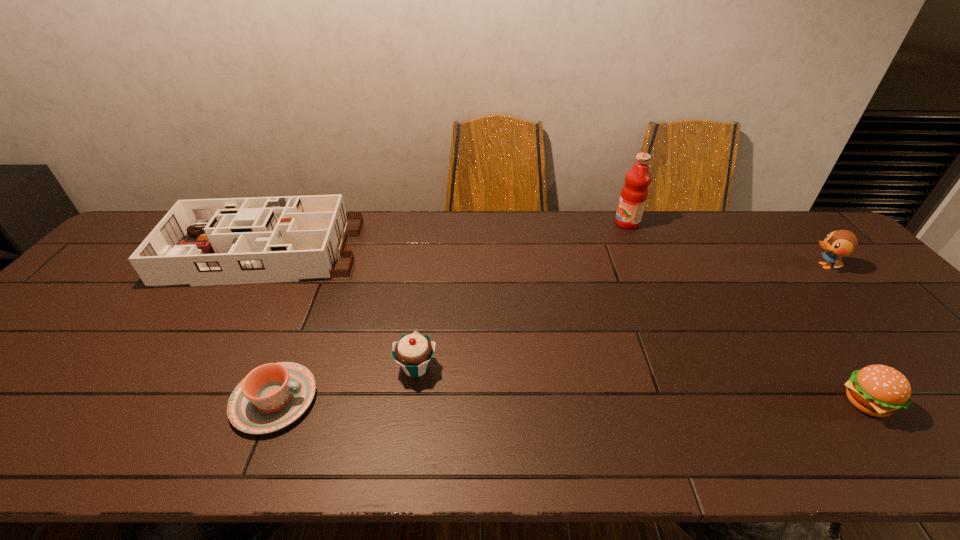
Identify the location of vacant space that satisfies the following two spatial constraints: 1. on the front label of the tallest object; 2. on the front side of the cupcake. (691, 367).

What are the coordinates of `vacant space that satisfies the following two spatial constraints: 1. on the front-facing side of the duck; 2. on the front side of the second object from right to left` in the screenshot? It's located at (949, 403).

The width and height of the screenshot is (960, 540). In order to click on free location that satisfies the following two spatial constraints: 1. on the back side of the second object from right to left; 2. on the front label of the third object from right to left in this screenshot , I will do `click(731, 223)`.